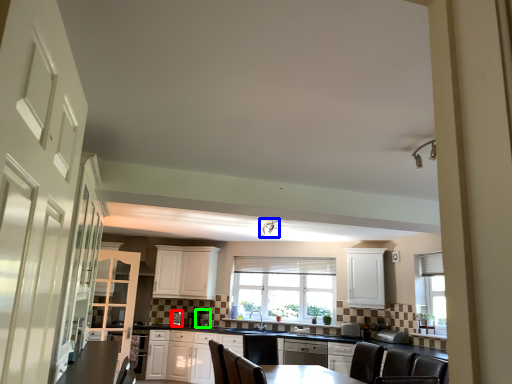
Question: Which is farther away from appliance (highlighted by a red box)? light fixture (highlighted by a blue box) or appliance (highlighted by a green box)?

Choices:
 (A) light fixture
 (B) appliance

Answer: (A)